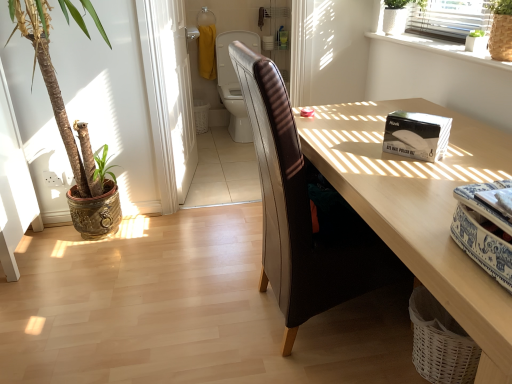
Where is `free spot below green leafy plant in textured pot at left, the first houseplant from the left (from a real-world perspective)`? This screenshot has width=512, height=384. free spot below green leafy plant in textured pot at left, the first houseplant from the left (from a real-world perspective) is located at coordinates (78, 243).